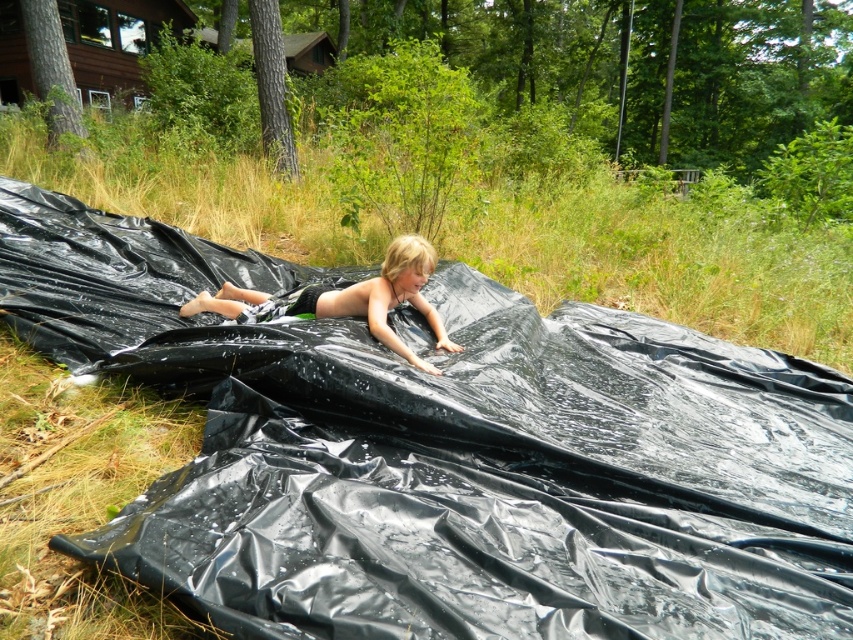
Who is positioned more to the left, green grass at center or blonde hair boy at center?

blonde hair boy at center is more to the left.

Does green grass at center have a lesser width compared to blonde hair boy at center?

In fact, green grass at center might be wider than blonde hair boy at center.

The image size is (853, 640). What do you see at coordinates (663, 259) in the screenshot? I see `green grass at center` at bounding box center [663, 259].

Locate an element on the screen. The width and height of the screenshot is (853, 640). green grass at center is located at coordinates pos(663,259).